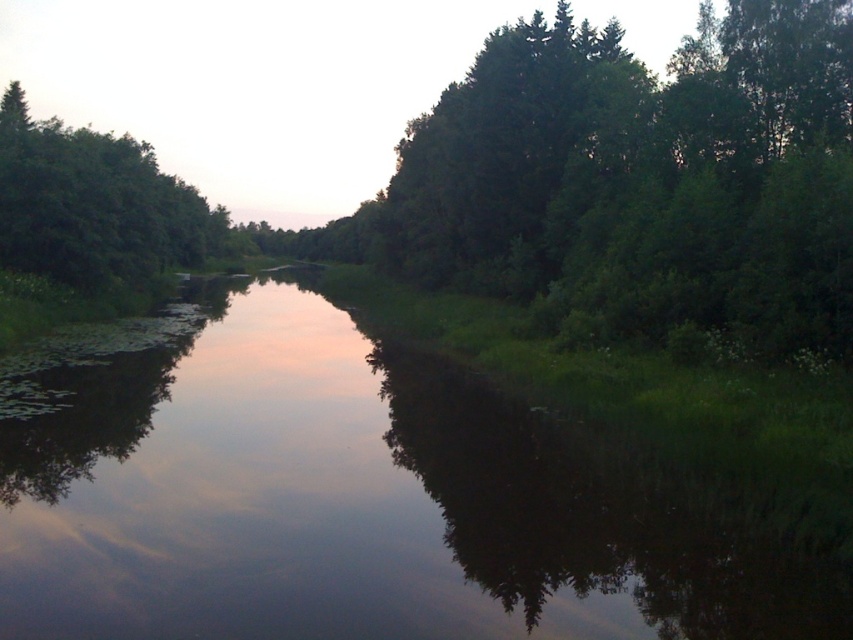
Which is behind, point (260, 497) or point (102, 246)?

Point (102, 246)

Can you confirm if green grassy stream at center is positioned above green leafy tree at left?

No.

This screenshot has width=853, height=640. Describe the element at coordinates (364, 502) in the screenshot. I see `green grassy stream at center` at that location.

Locate an element on the screen. This screenshot has height=640, width=853. green grassy stream at center is located at coordinates (364, 502).